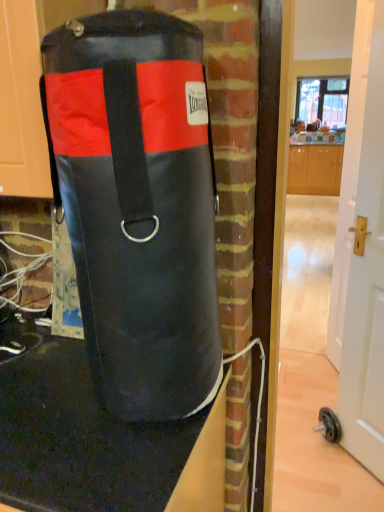
Question: Does black leather punching bag at center have a greater height compared to transparent glass window at upper center?

Choices:
 (A) yes
 (B) no

Answer: (B)

Question: Is black leather punching bag at center to the left of transparent glass window at upper center from the viewer's perspective?

Choices:
 (A) no
 (B) yes

Answer: (B)

Question: Can you confirm if black leather punching bag at center is positioned to the right of transparent glass window at upper center?

Choices:
 (A) no
 (B) yes

Answer: (A)

Question: Is black leather punching bag at center not inside transparent glass window at upper center?

Choices:
 (A) yes
 (B) no

Answer: (A)

Question: Could you tell me if black leather punching bag at center is facing transparent glass window at upper center?

Choices:
 (A) no
 (B) yes

Answer: (A)

Question: Is point (74, 245) positioned closer to the camera than point (296, 102)?

Choices:
 (A) closer
 (B) farther

Answer: (A)

Question: Would you say black leather punching bag at center is to the left or to the right of transparent glass window at upper center in the picture?

Choices:
 (A) right
 (B) left

Answer: (B)

Question: Is black leather punching bag at center inside or outside of transparent glass window at upper center?

Choices:
 (A) outside
 (B) inside

Answer: (A)

Question: In the image, is black leather punching bag at center positioned in front of or behind transparent glass window at upper center?

Choices:
 (A) behind
 (B) front

Answer: (B)

Question: Is transparent glass window at upper center inside or outside of black leather punching bag at center?

Choices:
 (A) outside
 (B) inside

Answer: (A)

Question: In the image, is transparent glass window at upper center positioned in front of or behind black leather punching bag at center?

Choices:
 (A) behind
 (B) front

Answer: (A)

Question: From their relative heights in the image, would you say transparent glass window at upper center is taller or shorter than black leather punching bag at center?

Choices:
 (A) short
 (B) tall

Answer: (B)

Question: Is transparent glass window at upper center wider or thinner than black leather punching bag at center?

Choices:
 (A) wide
 (B) thin

Answer: (B)

Question: Is transparent glass window at upper center inside the boundaries of black rubber mat at lower left, or outside?

Choices:
 (A) outside
 (B) inside

Answer: (A)

Question: From their relative heights in the image, would you say transparent glass window at upper center is taller or shorter than black rubber mat at lower left?

Choices:
 (A) short
 (B) tall

Answer: (B)